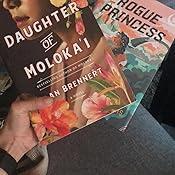
The width and height of the screenshot is (175, 175). Find the location of `folded beige fabric`. folded beige fabric is located at coordinates (38, 169).